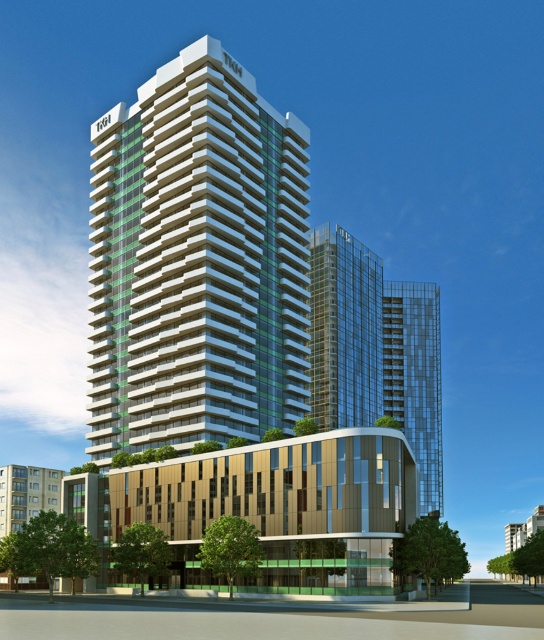
You are standing in front of the architectural complex and want to take a photo that includes both points, point [157,332] and point [314,228]. Which point will appear larger in the photo?

Point [157,332] is closer to the camera than point [314,228], so it will appear larger in the photo.

You are a drone operator planning to fly a drone between the white glossy building at center and the transparent glass building at center. The drone has a maximum flight distance of 50 meters. Can the drone safely complete the flight between them without exceeding its range?

The white glossy building at center and transparent glass building at center are 56.57 meters apart, which exceeds the drone maximum flight distance of 50 meters. Therefore, the drone cannot safely complete the flight between them without exceeding its range.

You are standing in front of the architectural complex and want to determine which of the two points, point (331, 289) or point (401, 332), is nearer to you. Based on the image, which point is closer?

Point (331, 289) is closer to the camera than point (401, 332), so it is the nearer one.